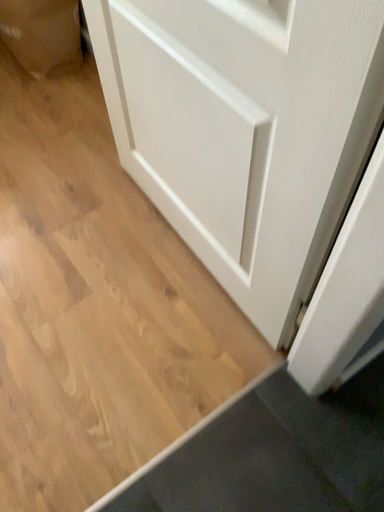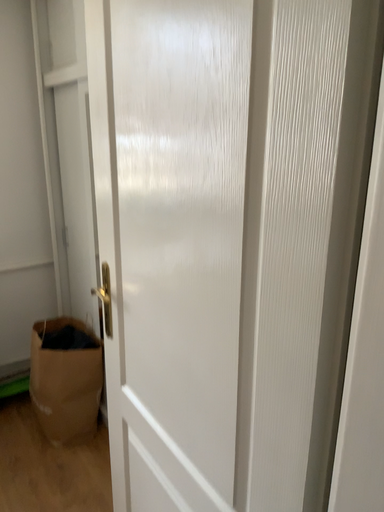
Question: How did the camera likely rotate when shooting the video?

Choices:
 (A) rotated downward
 (B) rotated upward

Answer: (B)